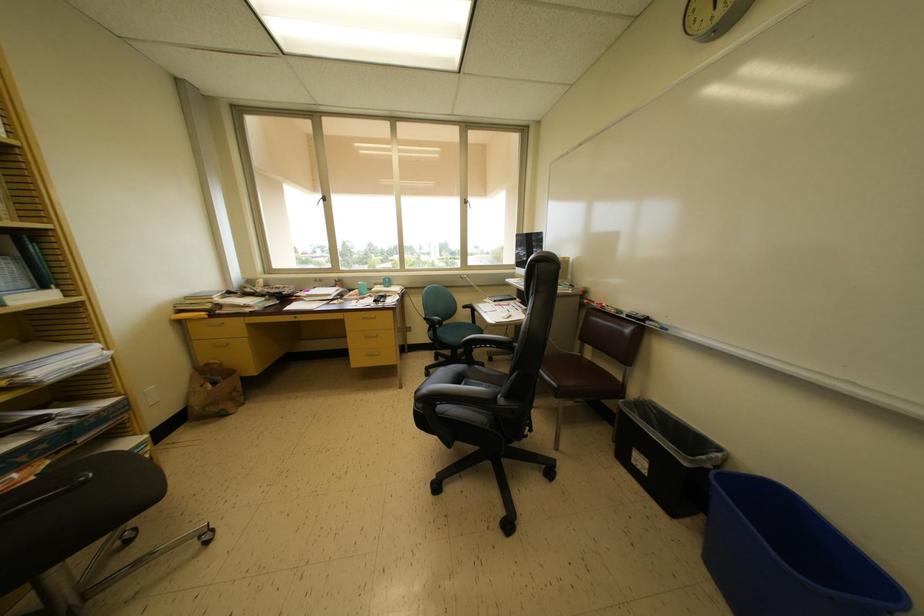
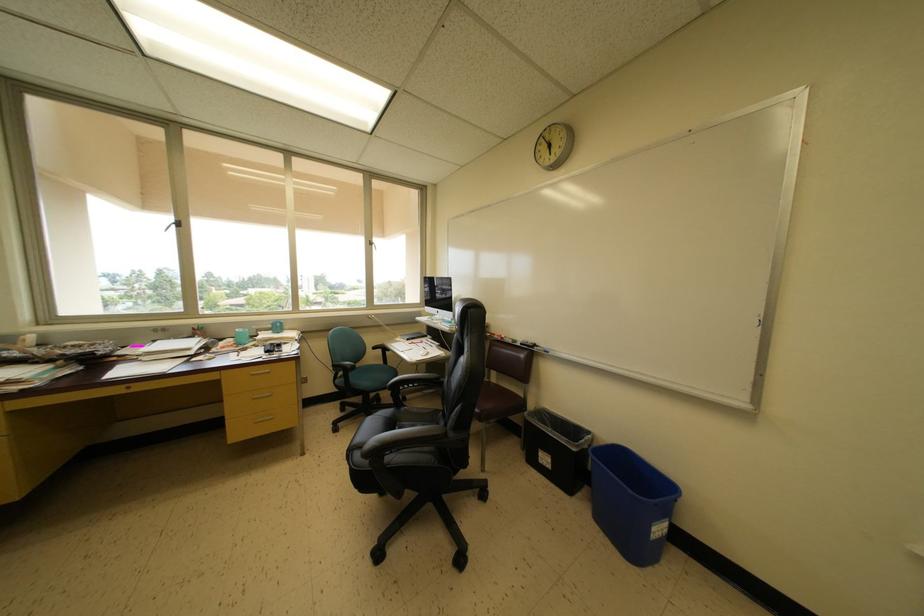
The point at [487,351] is marked in the first image. Where is the corresponding point in the second image?

(415, 391)